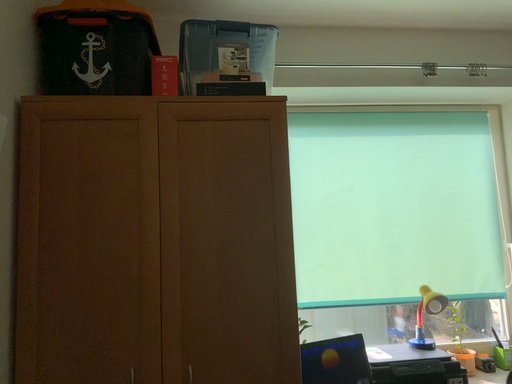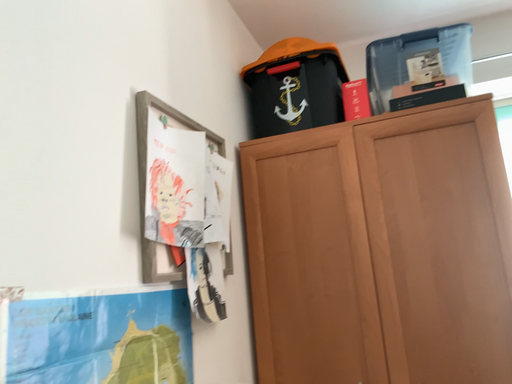
Question: Which way did the camera rotate in the video?

Choices:
 (A) rotated left
 (B) rotated right

Answer: (A)